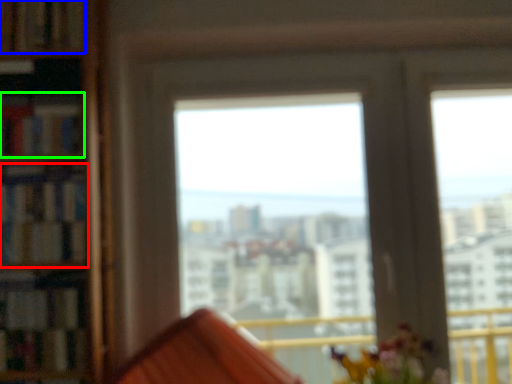
Question: Which object is the farthest from book (highlighted by a red box)? Choose among these: book (highlighted by a blue box) or book (highlighted by a green box).

Choices:
 (A) book
 (B) book

Answer: (A)